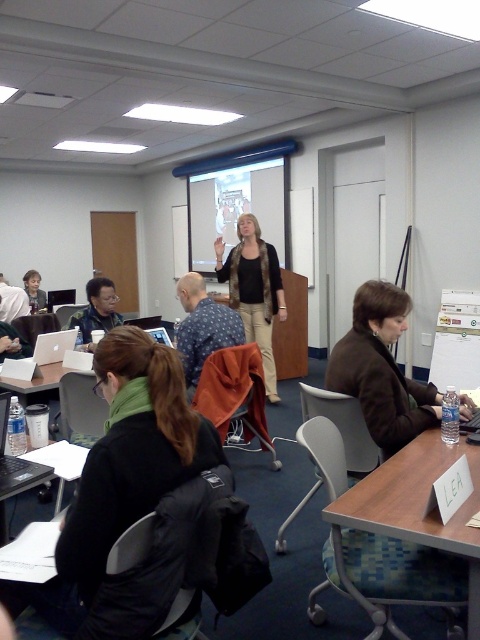
Does brown leather jacket at lower right have a greater width compared to matte black jacket at center?

Yes, brown leather jacket at lower right is wider than matte black jacket at center.

Measure the distance between point (389, 300) and camera.

Point (389, 300) is 7.47 feet away from camera.

Describe the element at coordinates (382, 369) in the screenshot. I see `brown leather jacket at lower right` at that location.

The image size is (480, 640). Identify the location of brown leather jacket at lower right. (382, 369).

Which is in front, point (60, 292) or point (159, 336)?

Point (159, 336) is in front.

Can you confirm if matte black laptop at left is shorter than silver metallic laptop at center?

In fact, matte black laptop at left may be taller than silver metallic laptop at center.

The width and height of the screenshot is (480, 640). Find the location of `matte black laptop at left`. matte black laptop at left is located at coordinates (60, 298).

Locate an element on the screen. brown wood table at lower right is located at coordinates (419, 506).

Consider the image. Can you confirm if brown wood table at lower right is positioned above matte black sweater at center?

Incorrect, brown wood table at lower right is not positioned above matte black sweater at center.

Does point (456, 531) come in front of point (265, 323)?

Yes, it is.

The height and width of the screenshot is (640, 480). In order to click on brown wood table at lower right in this screenshot , I will do `click(419, 506)`.